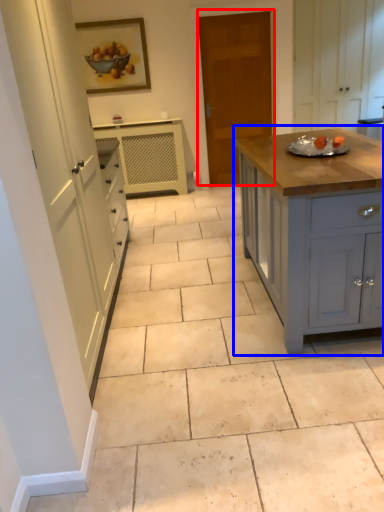
Question: Among these objects, which one is farthest to the camera, door (highlighted by a red box) or cabinetry (highlighted by a blue box)?

Choices:
 (A) door
 (B) cabinetry

Answer: (A)